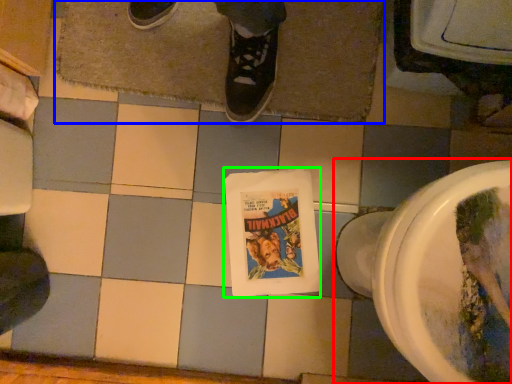
Question: Which object is the farthest from toilet (highlighted by a red box)? Choose among these: bath mat (highlighted by a blue box) or comic book (highlighted by a green box).

Choices:
 (A) bath mat
 (B) comic book

Answer: (A)